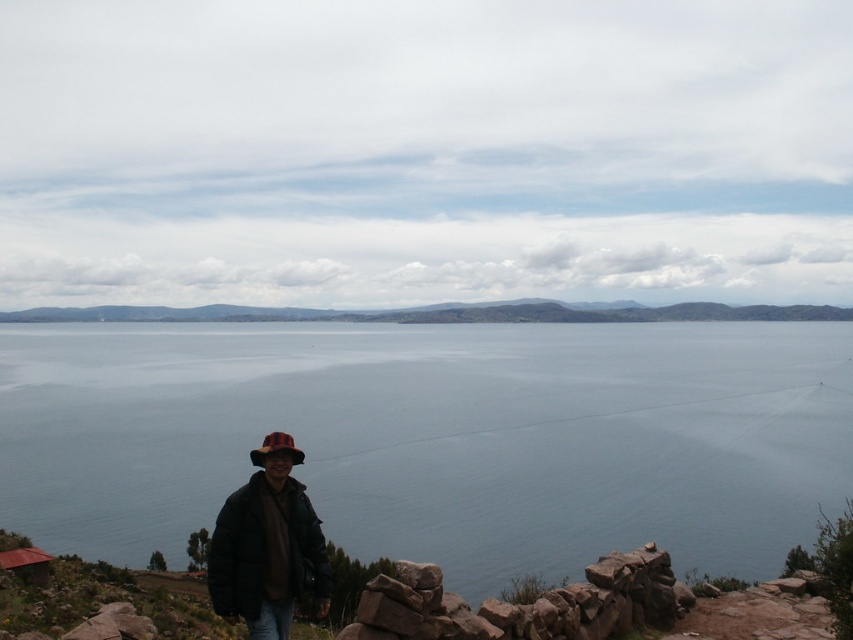
Question: Does green grassy hillside at center have a greater width compared to red felt hat at lower center?

Choices:
 (A) yes
 (B) no

Answer: (A)

Question: Which point is farther to the camera?

Choices:
 (A) (224, 547)
 (B) (210, 312)
 (C) (140, 369)
 (D) (279, 432)

Answer: (B)

Question: Which point appears closest to the camera in this image?

Choices:
 (A) (215, 582)
 (B) (292, 436)
 (C) (785, 464)

Answer: (A)

Question: Where is green grassy hillside at center located in relation to red felt hat at lower center in the image?

Choices:
 (A) right
 (B) left

Answer: (B)

Question: Can you confirm if blue water at center is wider than red felt hat at lower center?

Choices:
 (A) yes
 (B) no

Answer: (A)

Question: Which point is closer to the camera?

Choices:
 (A) red felt hat at lower center
 (B) green grassy hillside at center

Answer: (A)